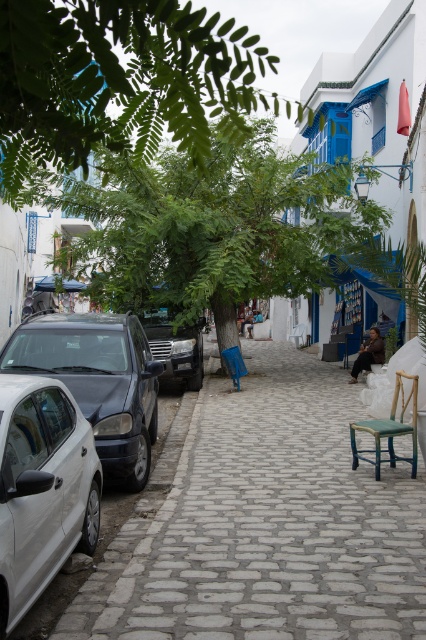
You are a pedestrian standing at the center of the street. You want to cross to the other side but need to avoid the parked cars. Which car, the white glossy car at left or the shiny black car at left, is closer to you so you can walk around it first?

The white glossy car at left is closer to the viewer than the shiny black car at left, so you should walk around the white glossy car at left first.

You are a delivery person trying to park your van in the street. There are two cars parked at the left side of the street. The white glossy car at left and the shiny black car at left. Which car is blocking the parking spot closer to the curb?

The white glossy car at left is positioned under shiny black car at left, so the shiny black car at left is blocking the parking spot closer to the curb.